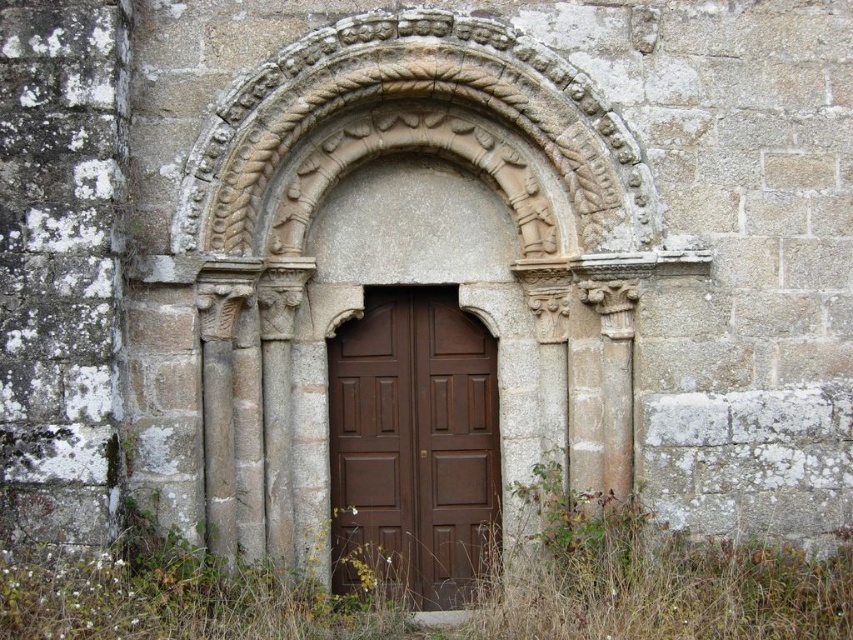
Who is shorter, green grass at lower center or brown wooden door at center?

green grass at lower center

Between green grass at lower center and brown wooden door at center, which one is positioned lower?

Positioned lower is green grass at lower center.

Who is more forward, (599,579) or (495,509)?

Positioned in front is point (599,579).

Locate an element on the screen. Image resolution: width=853 pixels, height=640 pixels. green grass at lower center is located at coordinates (659, 584).